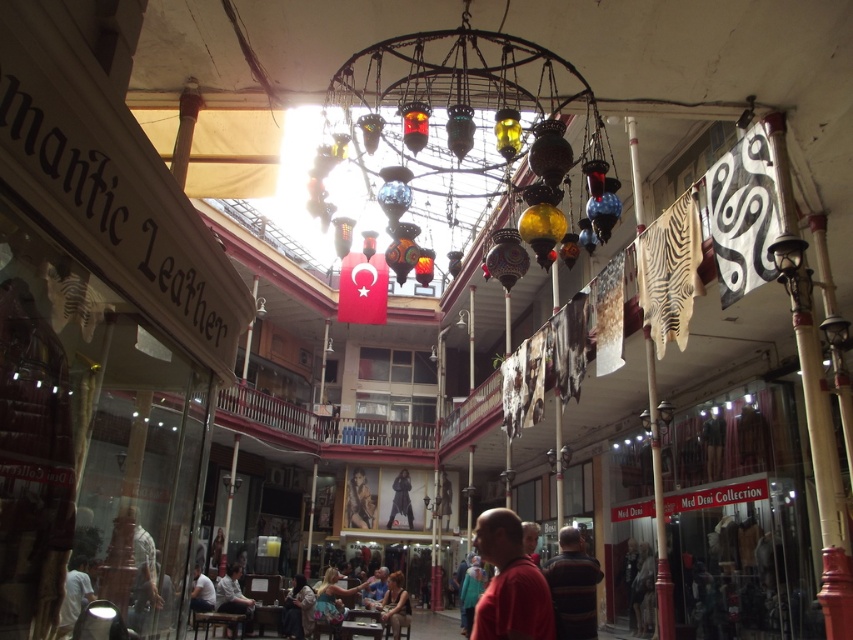
Does point (492, 618) come closer to viewer compared to point (405, 488)?

Yes, it is.

The image size is (853, 640). Identify the location of matte red shirt at center. (509, 582).

Which is more to the left, smooth skin portrait at center or smooth brown leather chair at center?

smooth skin portrait at center is more to the left.

Is smooth skin portrait at center closer to camera compared to smooth brown leather chair at center?

No, it is behind smooth brown leather chair at center.

Is point (364, 520) farther from viewer compared to point (401, 596)?

Yes, it is behind point (401, 596).

You are a GUI agent. You are given a task and a screenshot of the screen. Output one action in this format:
    pyautogui.click(x=<x>, y=<y>)
    Task: Click on the smooth skin portrait at center
    
    Given the screenshot: What is the action you would take?
    [x=360, y=497]

Does matte red shirt at center have a greater height compared to dark brown leather jacket at lower center?

Yes, matte red shirt at center is taller than dark brown leather jacket at lower center.

Measure the distance between point (494, 534) and camera.

Point (494, 534) and camera are 26.00 feet apart.

Find the location of a particular element. This screenshot has height=640, width=853. matte red shirt at center is located at coordinates (509, 582).